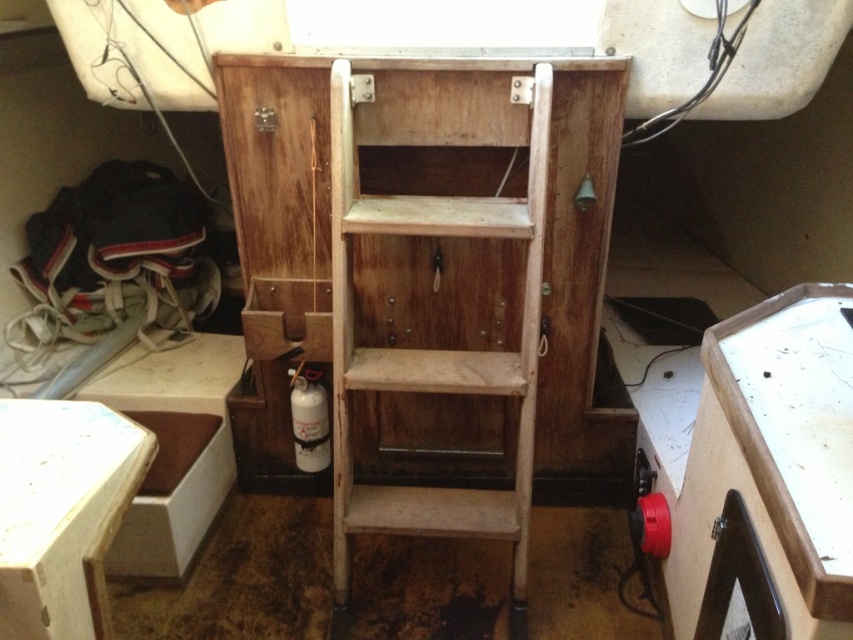
The width and height of the screenshot is (853, 640). Describe the element at coordinates (62, 513) in the screenshot. I see `white matte stool at lower left` at that location.

Is white matte stool at lower left wider than white matte gas canister at lower center?

Correct, the width of white matte stool at lower left exceeds that of white matte gas canister at lower center.

Is point (0, 467) positioned after point (306, 422)?

No, it is not.

What are the coordinates of `white matte stool at lower left` in the screenshot? It's located at (62, 513).

Between point (36, 621) and point (299, 291), which one is positioned in front?

Point (36, 621) is in front.

Which is behind, point (16, 404) or point (262, 284)?

Point (262, 284)

Who is more distant from viewer, (109, 524) or (283, 308)?

The point (283, 308) is more distant.

The height and width of the screenshot is (640, 853). I want to click on white matte stool at lower left, so click(x=62, y=513).

Can you confirm if wooden drawer at center is bigger than white matte gas canister at lower center?

Yes.

Which is more to the right, wooden drawer at center or white matte gas canister at lower center?

Positioned to the right is white matte gas canister at lower center.

Which is behind, point (297, 342) or point (305, 467)?

Positioned behind is point (305, 467).

This screenshot has height=640, width=853. I want to click on wooden drawer at center, so click(287, 320).